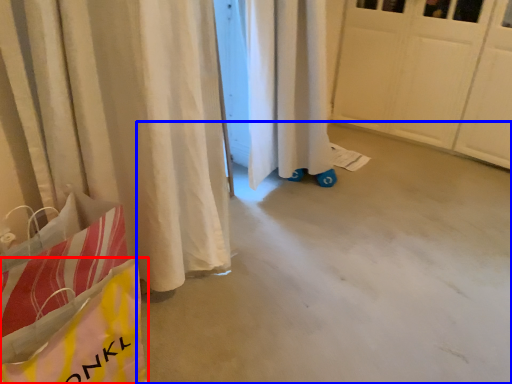
Question: Which point is closer to the camera, grocery bag (highlighted by a red box) or concrete (highlighted by a blue box)?

Choices:
 (A) grocery bag
 (B) concrete

Answer: (A)